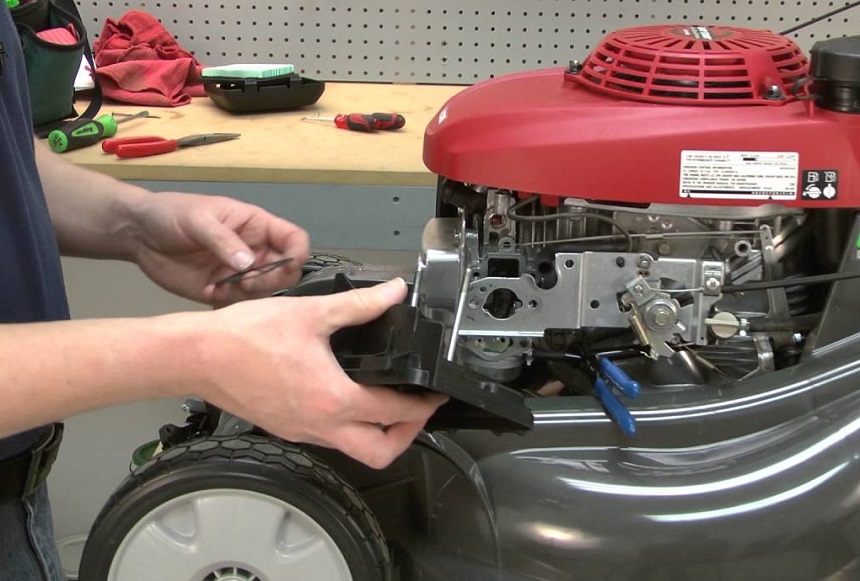
Find the location of a particular element. The width and height of the screenshot is (860, 581). cable is located at coordinates (775, 283).